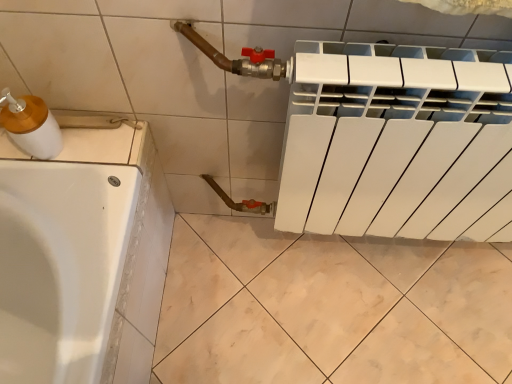
Describe the element at coordinates (31, 125) in the screenshot. I see `matte white soap dispenser at left` at that location.

This screenshot has width=512, height=384. I want to click on matte white soap dispenser at left, so click(x=31, y=125).

What do you see at coordinates (61, 133) in the screenshot? I see `white plastic sink at left` at bounding box center [61, 133].

Consider the image. In order to face white plastic sink at left, should I rotate leftwards or rightwards?

To align with it, rotate left about 28.278°.

Locate an element on the screen. white plastic sink at left is located at coordinates (61, 133).

I want to click on matte white soap dispenser at left, so click(x=31, y=125).

Considering the relative positions of white plastic sink at left and matte white soap dispenser at left in the image provided, is white plastic sink at left to the left or to the right of matte white soap dispenser at left?

Clearly, white plastic sink at left is on the left of matte white soap dispenser at left in the image.

Considering the positions of objects white plastic sink at left and matte white soap dispenser at left in the image provided, who is in front, white plastic sink at left or matte white soap dispenser at left?

matte white soap dispenser at left is more forward.

Is point (30, 130) closer to viewer compared to point (56, 126)?

Yes, point (30, 130) is in front of point (56, 126).

From the image's perspective, is white plastic sink at left above or below matte white soap dispenser at left?

white plastic sink at left is below matte white soap dispenser at left.

From a real-world perspective, is white plastic sink at left located beneath matte white soap dispenser at left?

Indeed, from a real-world perspective, white plastic sink at left is positioned beneath matte white soap dispenser at left.

Which object is thinner, white plastic sink at left or matte white soap dispenser at left?

matte white soap dispenser at left is thinner.

Considering the sizes of objects white plastic sink at left and matte white soap dispenser at left in the image provided, who is taller, white plastic sink at left or matte white soap dispenser at left?

With more height is matte white soap dispenser at left.

Who is smaller, white plastic sink at left or matte white soap dispenser at left?

With smaller size is matte white soap dispenser at left.

Could matte white soap dispenser at left be considered to be inside white plastic sink at left?

Definitely not — matte white soap dispenser at left is not inside white plastic sink at left.

Is white plastic sink at left with matte white soap dispenser at left?

Yes, white plastic sink at left is with matte white soap dispenser at left.

Does white plastic sink at left turn towards matte white soap dispenser at left?

Yes, white plastic sink at left is oriented towards matte white soap dispenser at left.

Consider the image. How many degrees apart are the facing directions of white plastic sink at left and matte white soap dispenser at left?

There is a 0.00235-degree angle between the facing directions of white plastic sink at left and matte white soap dispenser at left.

What are the coordinates of `sink below the matte white soap dispenser at left (from the image's perspective)` in the screenshot? It's located at (61, 133).

Looking at this image, can you confirm if matte white soap dispenser at left is positioned to the right of white plastic sink at left?

Correct, you'll find matte white soap dispenser at left to the right of white plastic sink at left.

Consider the image. Is matte white soap dispenser at left positioned before white plastic sink at left?

Yes.

Does point (50, 157) come farther from viewer compared to point (98, 118)?

No, (50, 157) is in front of (98, 118).

From the image's perspective, between matte white soap dispenser at left and white plastic sink at left, who is located below?

white plastic sink at left appears lower in the image.

From a real-world perspective, between matte white soap dispenser at left and white plastic sink at left, who is vertically lower?

white plastic sink at left, from a real-world perspective.

Can you confirm if matte white soap dispenser at left is thinner than white plastic sink at left?

Correct, the width of matte white soap dispenser at left is less than that of white plastic sink at left.

Considering the sizes of objects matte white soap dispenser at left and white plastic sink at left in the image provided, who is shorter, matte white soap dispenser at left or white plastic sink at left?

With less height is white plastic sink at left.

Who is bigger, matte white soap dispenser at left or white plastic sink at left?

white plastic sink at left.

Is matte white soap dispenser at left not within white plastic sink at left?

Yes, matte white soap dispenser at left is located beyond the bounds of white plastic sink at left.

Is matte white soap dispenser at left not close to white plastic sink at left?

No, matte white soap dispenser at left is in close proximity to white plastic sink at left.

Could you tell me if matte white soap dispenser at left is facing white plastic sink at left?

No, matte white soap dispenser at left is not oriented towards white plastic sink at left.

What's the angular difference between matte white soap dispenser at left and white plastic sink at left's facing directions?

The angle between the facing direction of matte white soap dispenser at left and the facing direction of white plastic sink at left is 0.00235 degrees.

This screenshot has width=512, height=384. Find the location of `soap dispenser on the right of white plastic sink at left`. soap dispenser on the right of white plastic sink at left is located at coordinates (31, 125).

At what (x,y) coordinates should I click in order to perform the action: click on soap dispenser above the white plastic sink at left (from the image's perspective). Please return your answer as a coordinate pair (x, y). This screenshot has height=384, width=512. Looking at the image, I should click on (31, 125).

You are a GUI agent. You are given a task and a screenshot of the screen. Output one action in this format:
    pyautogui.click(x=<x>, y=<y>)
    Task: Click on the sink that is under the matte white soap dispenser at left (from a real-world perspective)
    This screenshot has height=384, width=512.
    Given the screenshot: What is the action you would take?
    pyautogui.click(x=61, y=133)